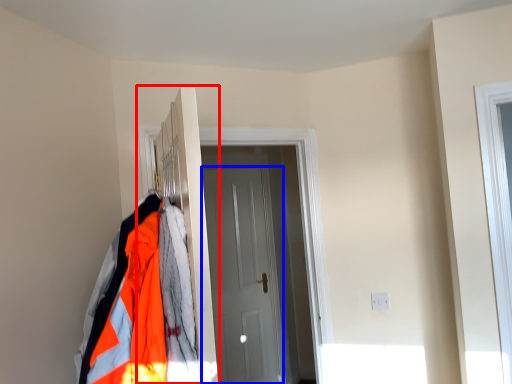
Question: Among these objects, which one is farthest to the camera, closet (highlighted by a red box) or door (highlighted by a blue box)?

Choices:
 (A) closet
 (B) door

Answer: (B)